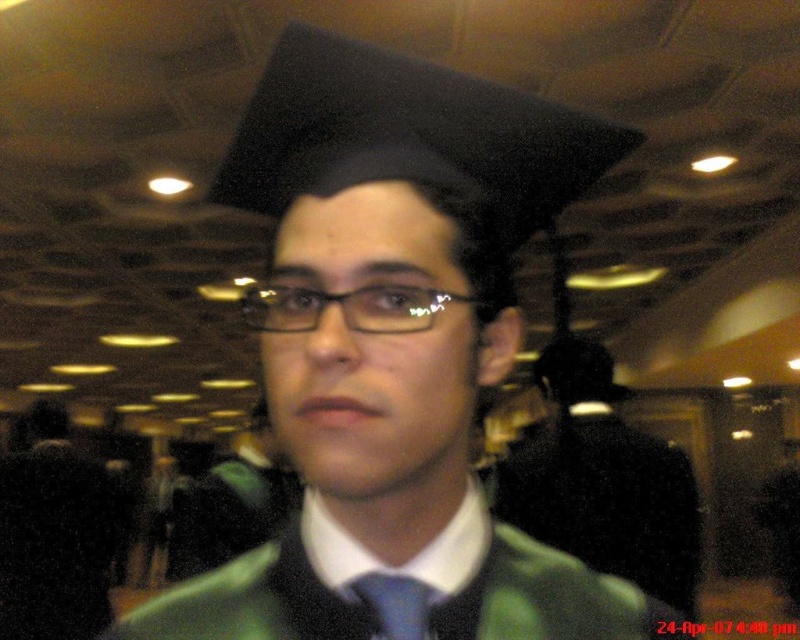
Question: Is matte black graduation cap at upper center thinner than black plastic glasses at center?

Choices:
 (A) yes
 (B) no

Answer: (B)

Question: Can you confirm if matte black graduation cap at upper center is positioned below black plastic glasses at center?

Choices:
 (A) yes
 (B) no

Answer: (A)

Question: Which of the following is the farthest from the observer?

Choices:
 (A) (432, 600)
 (B) (412, 456)
 (C) (580, 556)

Answer: (C)

Question: Among these objects, which one is farthest from the camera?

Choices:
 (A) blue silk tie at center
 (B) black plastic glasses at center

Answer: (A)

Question: Does green matte graduation gown at center appear under blue silk tie at center?

Choices:
 (A) yes
 (B) no

Answer: (A)

Question: Which point is farther to the camera?

Choices:
 (A) matte black graduation cap at upper center
 (B) blue silk tie at center
 (C) black plastic glasses at center

Answer: (B)